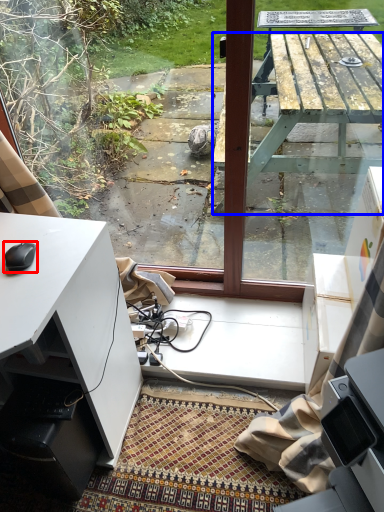
Question: Which object appears closest to the camera in this image, mouse (highlighted by a red box) or table (highlighted by a blue box)?

Choices:
 (A) mouse
 (B) table

Answer: (B)